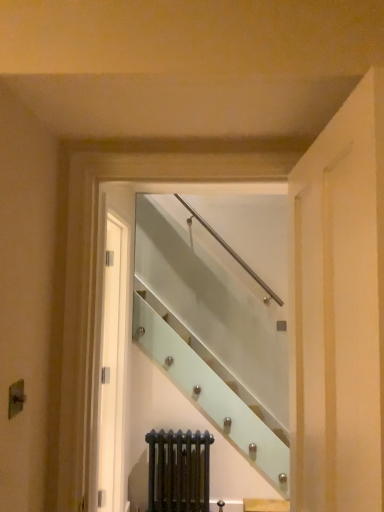
Question: In the image, is clear glass staircase at center on the left side or the right side of dark green radiator at lower center?

Choices:
 (A) left
 (B) right

Answer: (B)

Question: Relative to dark green radiator at lower center, is clear glass staircase at center in front or behind?

Choices:
 (A) front
 (B) behind

Answer: (A)

Question: Considering the positions of clear glass staircase at center and dark green radiator at lower center in the image, is clear glass staircase at center bigger or smaller than dark green radiator at lower center?

Choices:
 (A) small
 (B) big

Answer: (B)

Question: Is dark green radiator at lower center wider or thinner than clear glass staircase at center?

Choices:
 (A) thin
 (B) wide

Answer: (A)

Question: From a real-world perspective, is dark green radiator at lower center positioned above or below clear glass staircase at center?

Choices:
 (A) above
 (B) below

Answer: (B)

Question: In terms of height, does dark green radiator at lower center look taller or shorter compared to clear glass staircase at center?

Choices:
 (A) short
 (B) tall

Answer: (A)

Question: Do you think dark green radiator at lower center is within clear glass staircase at center, or outside of it?

Choices:
 (A) outside
 (B) inside

Answer: (A)